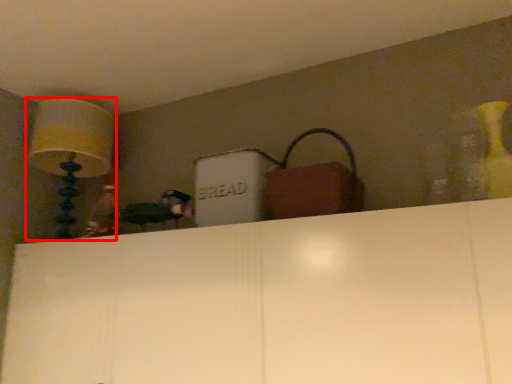
Question: From the image's perspective, considering the relative positions of lamp (annotated by the red box) and handbag in the image provided, where is lamp (annotated by the red box) located with respect to the staircase?

Choices:
 (A) below
 (B) above

Answer: (B)